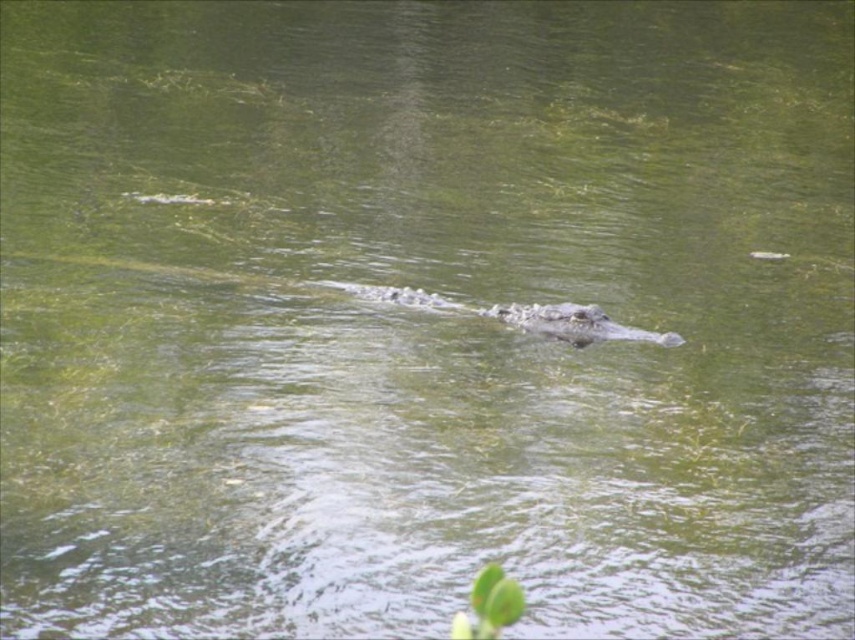
You are a wildlife photographer trying to capture a clear photo of both the dark gray textured crocodile at center and the dark green scaly crocodile at center. Given that your camera has a minimum focus distance of 5 inches, can you focus on both crocodiles simultaneously?

The dark gray textured crocodile at center is 5.24 inches away from the dark green scaly crocodile at center. Since the minimum focus distance is 5 inches, the camera can focus on both crocodiles as the distance between them is just over the required minimum.

You are a wildlife photographer trying to capture both the dark gray textured crocodile at center and the dark green scaly crocodile at center in the same frame. Based on their positions, which crocodile should you adjust your camera to focus on first to ensure both are in the shot?

The dark gray textured crocodile at center is positioned on the left side of the dark green scaly crocodile at center. To ensure both are in the shot, you should focus on the dark green scaly crocodile at center first since it is on the right, allowing you to frame the left crocodile alongside it.

You are a wildlife photographer aiming to capture a closeup shot of the dark gray textured crocodile at center. Your camera has a maximum zoom range of 10 meters. Can you get a clear closeup without moving closer physically?

The dark gray textured crocodile at center is 8.81 meters away. Since your camera can zoom up to 10 meters, you can capture a clear closeup without moving closer.